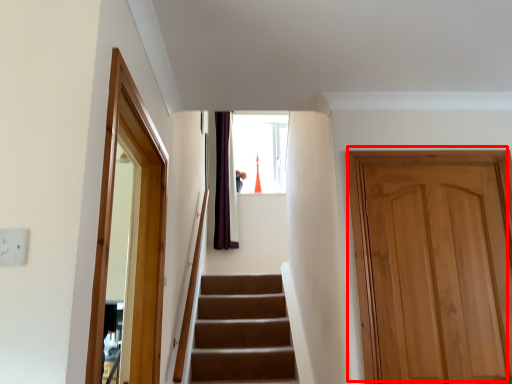
Question: From the image, what is the correct spatial relationship of door (annotated by the red box) in relation to screen door?

Choices:
 (A) left
 (B) right

Answer: (B)